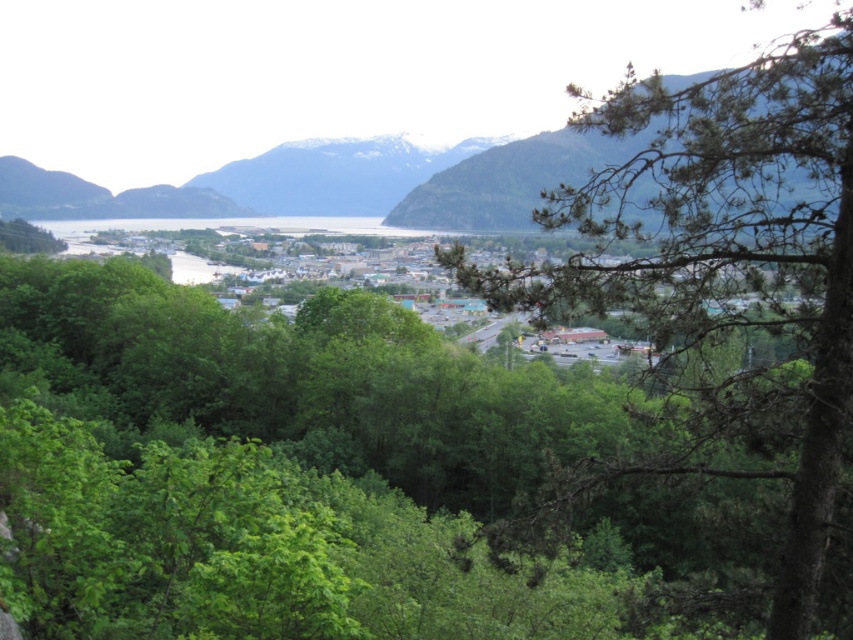
You are an outdoor enthusiast planning a hiking route. You see the green textured mountain at upper center and the snowy rock mountain at center. Which mountain should you choose if you want to start your hike from the nearest point?

You should choose the green textured mountain at upper center because it is closer to the viewer than the snowy rock mountain at center, making it the nearest starting point.

You are standing in the scenic town and want to take a photo of both the green leafy tree at center and the snowy rock mountain at center. Which object should you position closer to the left side of your camera frame to include both in the photo?

You should position the snowy rock mountain at center closer to the left side of your camera frame because the green leafy tree at center is to the right of the snowy rock mountain at center, so moving the mountain leftward would allow both to fit within the frame.